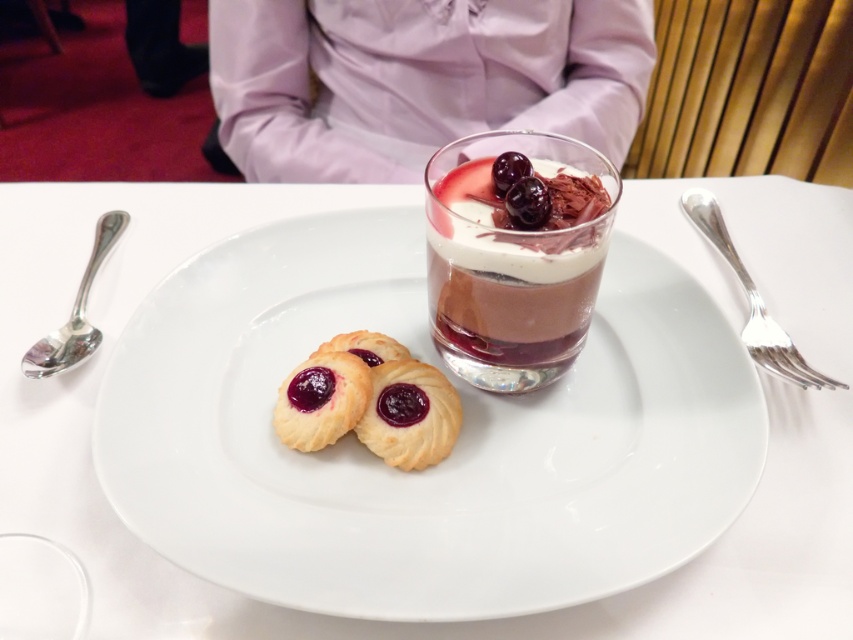
Between point (552, 284) and point (523, 192), which one is positioned in front?

Point (523, 192) is more forward.

Can you confirm if chocolate mousse at center is positioned above shiny dark red cherry at center?

No, chocolate mousse at center is not above shiny dark red cherry at center.

Is point (483, 296) in front of point (523, 186)?

No, (483, 296) is behind (523, 186).

Find the location of `chocolate mousse at center`. chocolate mousse at center is located at coordinates (515, 259).

Is silver metallic fork at right above slightly glossy dark purple jam at center?

Yes.

Is point (817, 387) closer to viewer compared to point (424, 397)?

No, it is behind (424, 397).

This screenshot has height=640, width=853. Find the location of `silver metallic fork at right`. silver metallic fork at right is located at coordinates (753, 301).

Can you confirm if chocolate mousse at center is bigger than silver metallic fork at right?

Yes, chocolate mousse at center is bigger than silver metallic fork at right.

Between point (438, 304) and point (718, 211), which one is positioned in front?

Point (438, 304)

Where is `chocolate mousse at center`? This screenshot has height=640, width=853. chocolate mousse at center is located at coordinates (515, 259).